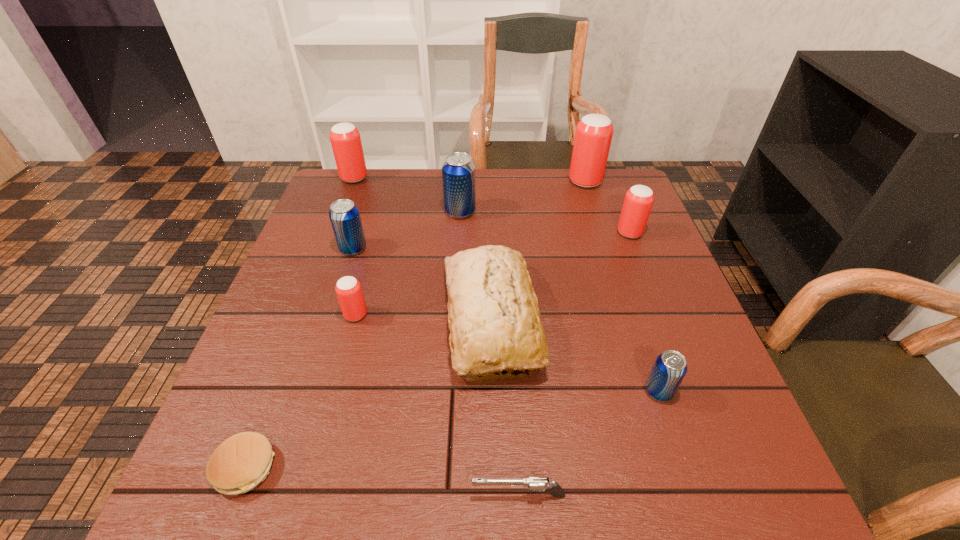
The image size is (960, 540). I want to click on vacant point located between the second biggest red beer can and the second smallest red beer can, so click(492, 205).

Locate an element on the screen. The height and width of the screenshot is (540, 960). free area in between the shortest object and the tallest beer can is located at coordinates (416, 325).

Where is `free space that is in between the patty and the leftmost red beer can`? Image resolution: width=960 pixels, height=540 pixels. free space that is in between the patty and the leftmost red beer can is located at coordinates tap(300, 323).

Find the location of a particular element. The image size is (960, 540). blank region between the smallest blue beer can and the third farthest red beer can is located at coordinates (644, 312).

Find the location of a particular element. This screenshot has width=960, height=540. free spot between the bread and the second nearest red beer can is located at coordinates (561, 276).

The width and height of the screenshot is (960, 540). I want to click on free spot between the second smallest red beer can and the shortest object, so click(438, 350).

The height and width of the screenshot is (540, 960). What are the coordinates of `the ninth closest object to the leftmost red beer can` in the screenshot? It's located at (670, 367).

Identify the location of object that is the seventh closest to the silver pistol. (458, 170).

Image resolution: width=960 pixels, height=540 pixels. I want to click on beer can that stands as the second closest to the bread, so click(x=670, y=367).

Point out which beer can is positioned as the sixth nearest to the second nearest blue beer can. Please provide its 2D coordinates. Your answer should be formatted as a tuple, i.e. [(x, y)], where the tuple contains the x and y coordinates of a point satisfying the conditions above.

[(670, 367)]